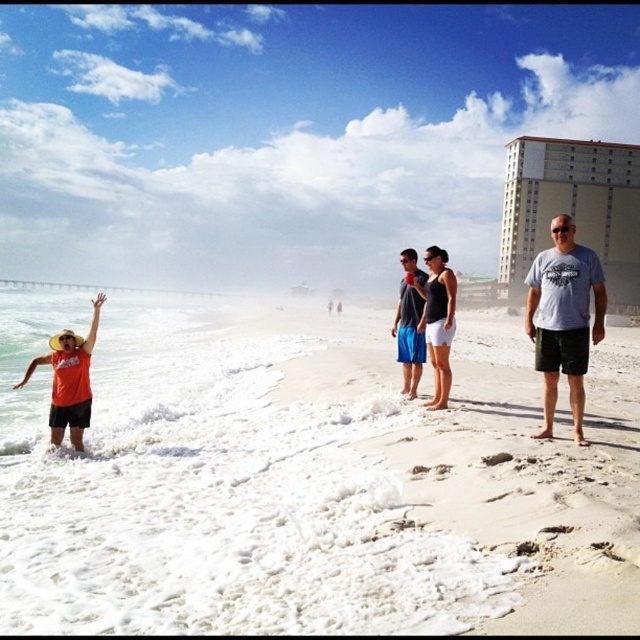
What are the coordinates of the white sandy beach at lower left in the image?

The white sandy beach at lower left is located at coordinates point [308,480].